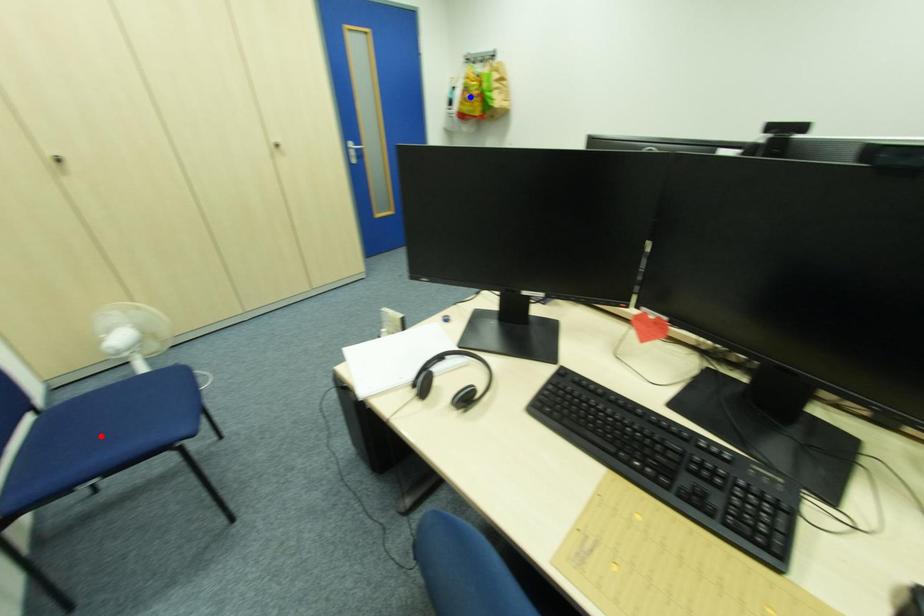
Question: In the image, two points are highlighted. Which point is nearer to the camera? Reply with the corresponding letter.

Choices:
 (A) blue point
 (B) red point

Answer: (B)